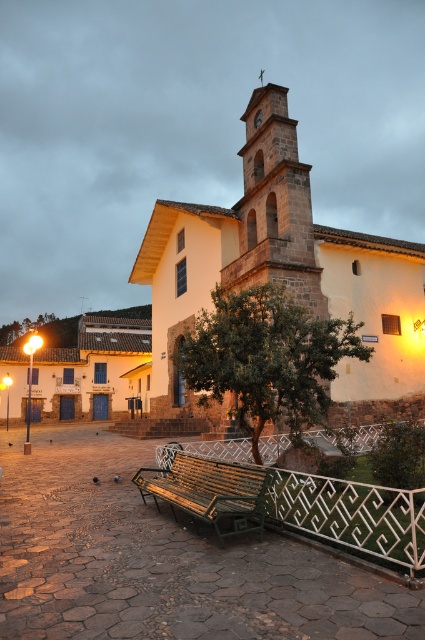
Who is more forward, (410, 348) or (209, 490)?

Point (209, 490)

Which is more to the right, white stone church at center or green wooden bench at center?

white stone church at center

Which is in front, point (388, 294) or point (206, 492)?

Point (206, 492)

This screenshot has height=640, width=425. I want to click on white stone church at center, so click(285, 275).

Which of these two, dark brown stone bell tower at center or green wooden bench at center, stands taller?

Standing taller between the two is dark brown stone bell tower at center.

Find the location of a particular element. The height and width of the screenshot is (640, 425). dark brown stone bell tower at center is located at coordinates (274, 205).

Is white stone church at center above dark brown stone bell tower at center?

Actually, white stone church at center is below dark brown stone bell tower at center.

From the picture: Can you confirm if white stone church at center is positioned to the right of dark brown stone bell tower at center?

No, white stone church at center is not to the right of dark brown stone bell tower at center.

Describe the element at coordinates (285, 275) in the screenshot. I see `white stone church at center` at that location.

Locate an element on the screen. white stone church at center is located at coordinates (285, 275).